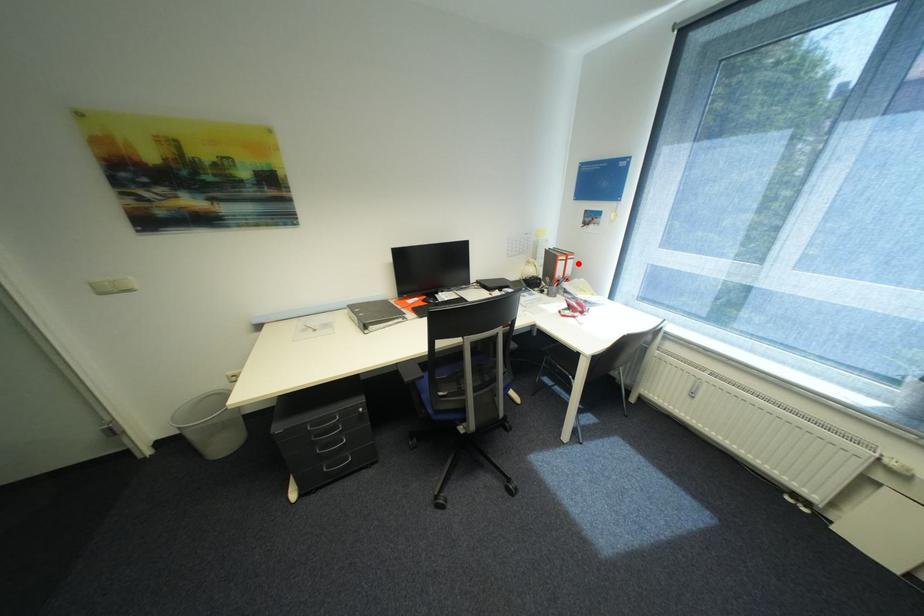
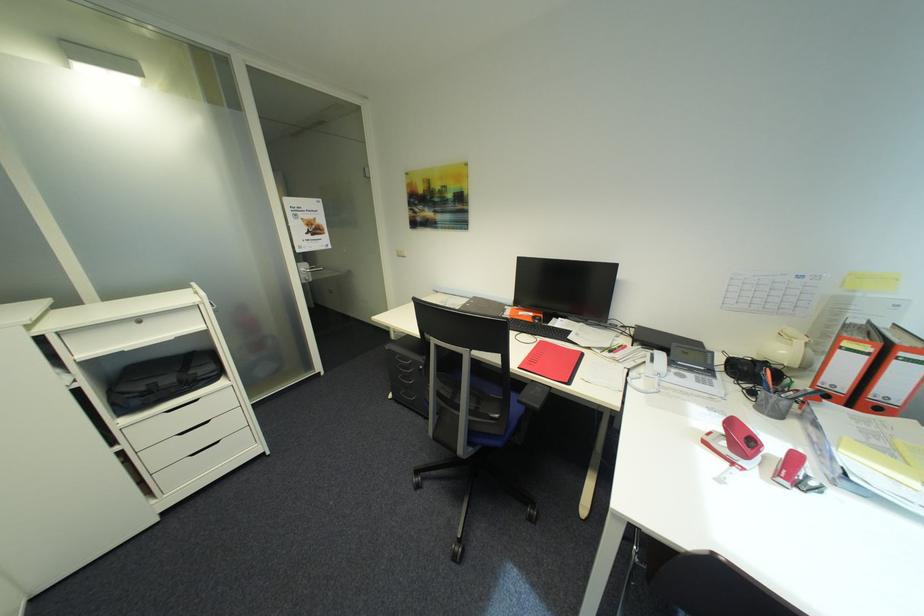
In the second image, find the point that corresponds to the highlighted location in the first image.

(912, 371)